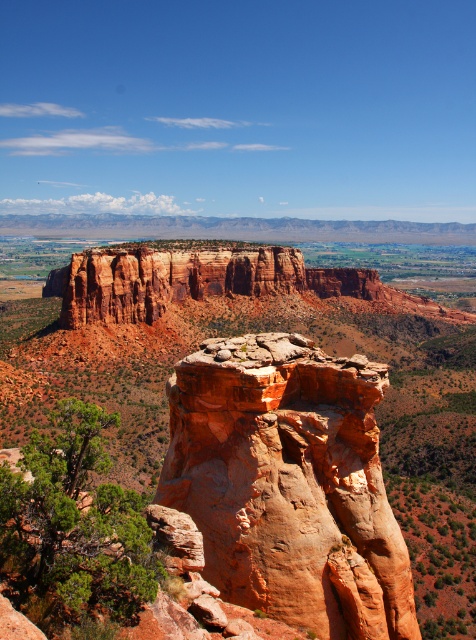
Can you confirm if rustic sandstone canyon at center is taller than rustic sandstone rock formation at center?

Correct, rustic sandstone canyon at center is much taller as rustic sandstone rock formation at center.

Which is more to the right, rustic sandstone canyon at center or rustic sandstone rock formation at center?

rustic sandstone rock formation at center

I want to click on rustic sandstone canyon at center, so click(257, 332).

Image resolution: width=476 pixels, height=640 pixels. What are the coordinates of `rustic sandstone canyon at center` in the screenshot? It's located at (257, 332).